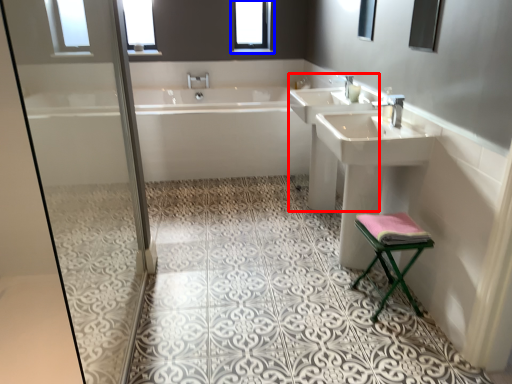
Question: Which of the following is the farthest to the observer, sink (highlighted by a red box) or window (highlighted by a blue box)?

Choices:
 (A) sink
 (B) window

Answer: (B)